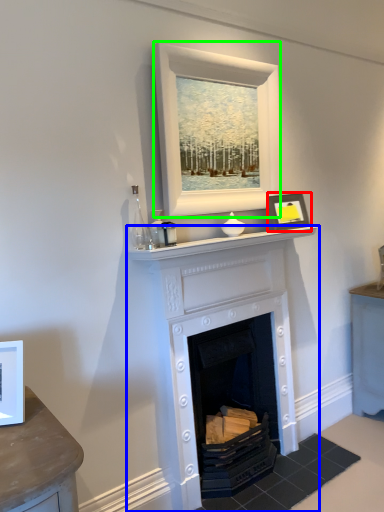
Question: Estimate the real-world distances between objects in this image. Which object is closer to picture frame (highlighted by a red box), fireplace (highlighted by a blue box) or picture frame (highlighted by a green box)?

Choices:
 (A) fireplace
 (B) picture frame

Answer: (B)